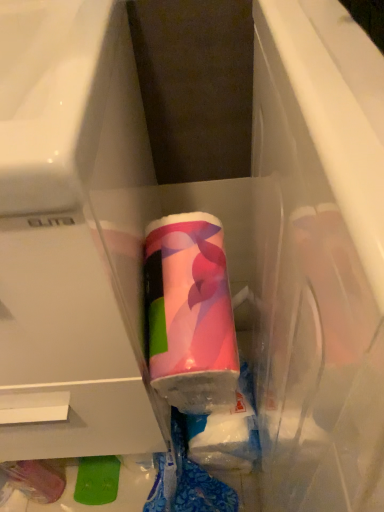
What are the coordinates of `matte plastic drawer at center` in the screenshot? It's located at (68, 348).

Describe the element at coordinates (68, 348) in the screenshot. I see `matte plastic drawer at center` at that location.

The image size is (384, 512). What do you see at coordinates (190, 314) in the screenshot?
I see `pink glossy tube at center` at bounding box center [190, 314].

What is the approximate height of pink glossy tube at center?

It is 15.55 inches.

Identify the location of pink glossy tube at center. (190, 314).

This screenshot has height=512, width=384. Find the location of `matte plastic drawer at center`. matte plastic drawer at center is located at coordinates point(68,348).

Can you confirm if matte plastic drawer at center is positioned to the right of pink glossy tube at center?

In fact, matte plastic drawer at center is to the left of pink glossy tube at center.

In the scene shown: Does matte plastic drawer at center lie in front of pink glossy tube at center?

Yes.

Which is behind, point (115, 298) or point (196, 311)?

Point (196, 311)

From the image's perspective, which one is positioned higher, matte plastic drawer at center or pink glossy tube at center?

matte plastic drawer at center is shown above in the image.

From a real-world perspective, is matte plastic drawer at center below pink glossy tube at center?

No, from a real-world perspective, matte plastic drawer at center is not beneath pink glossy tube at center.

Can you confirm if matte plastic drawer at center is wider than pink glossy tube at center?

Correct, the width of matte plastic drawer at center exceeds that of pink glossy tube at center.

From their relative heights in the image, would you say matte plastic drawer at center is taller or shorter than pink glossy tube at center?

matte plastic drawer at center is taller than pink glossy tube at center.

Can you confirm if matte plastic drawer at center is smaller than pink glossy tube at center?

No.

Is matte plastic drawer at center positioned beyond the bounds of pink glossy tube at center?

Indeed, matte plastic drawer at center is completely outside pink glossy tube at center.

Is matte plastic drawer at center directly adjacent to pink glossy tube at center?

Yes, matte plastic drawer at center is right next to pink glossy tube at center and making contact.

Is matte plastic drawer at center turned away from pink glossy tube at center?

No, pink glossy tube at center is not at the back of matte plastic drawer at center.

What's the angular difference between matte plastic drawer at center and pink glossy tube at center's facing directions?

The facing directions of matte plastic drawer at center and pink glossy tube at center are 0.000701 degrees apart.

Locate an element on the screen. toothpaste on the right of matte plastic drawer at center is located at coordinates (190, 314).

Considering the positions of objects pink glossy tube at center and matte plastic drawer at center in the image provided, who is more to the right, pink glossy tube at center or matte plastic drawer at center?

From the viewer's perspective, pink glossy tube at center appears more on the right side.

Considering the positions of objects pink glossy tube at center and matte plastic drawer at center in the image provided, who is behind, pink glossy tube at center or matte plastic drawer at center?

pink glossy tube at center.

Which is less distant, (x=190, y=217) or (x=31, y=361)?

Point (x=190, y=217) appears to be farther away from the viewer than point (x=31, y=361).

From the image's perspective, which one is positioned lower, pink glossy tube at center or matte plastic drawer at center?

pink glossy tube at center appears lower in the image.

From a real-world perspective, is pink glossy tube at center positioned under matte plastic drawer at center based on gravity?

Yes.

Can you confirm if pink glossy tube at center is wider than matte plastic drawer at center?

No, pink glossy tube at center is not wider than matte plastic drawer at center.

Who is taller, pink glossy tube at center or matte plastic drawer at center?

matte plastic drawer at center.

Can you confirm if pink glossy tube at center is smaller than matte plastic drawer at center?

Correct, pink glossy tube at center occupies less space than matte plastic drawer at center.

Is matte plastic drawer at center located within pink glossy tube at center?

No, pink glossy tube at center does not contain matte plastic drawer at center.

From the picture: Are pink glossy tube at center and matte plastic drawer at center located far from each other?

No, pink glossy tube at center is in close proximity to matte plastic drawer at center.

Is pink glossy tube at center facing towards matte plastic drawer at center?

No, pink glossy tube at center is not facing towards matte plastic drawer at center.

How far apart are pink glossy tube at center and matte plastic drawer at center?

They are 9.96 centimeters apart.

The height and width of the screenshot is (512, 384). What are the coordinates of `toothpaste located behind the matte plastic drawer at center` in the screenshot? It's located at (190, 314).

You are a GUI agent. You are given a task and a screenshot of the screen. Output one action in this format:
    pyautogui.click(x=<x>, y=<y>)
    Task: Click on the toothpaste on the right of matte plastic drawer at center
    
    Given the screenshot: What is the action you would take?
    pyautogui.click(x=190, y=314)

There is a pink glossy tube at center. Identify the location of drawer above it (from a real-world perspective). The image size is (384, 512). (68, 348).